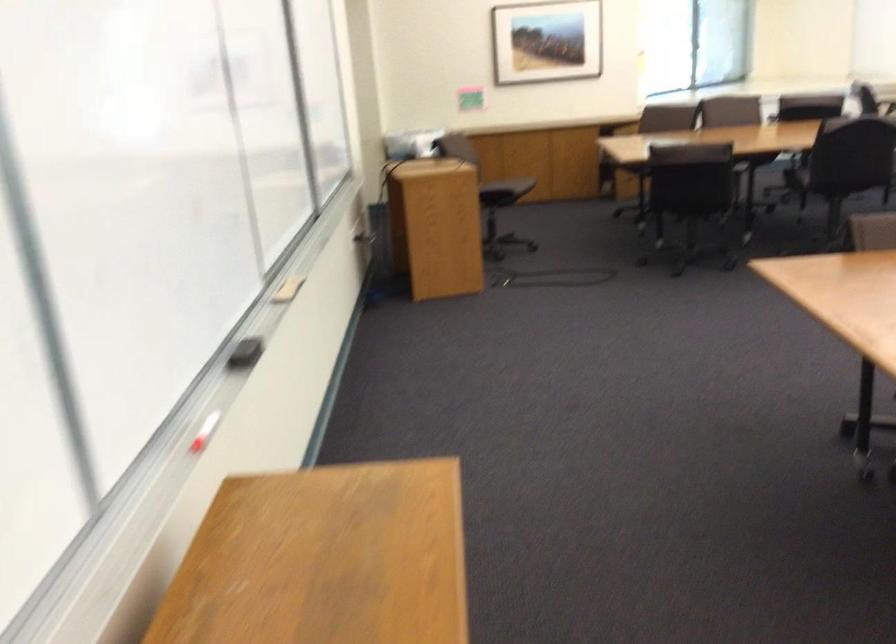
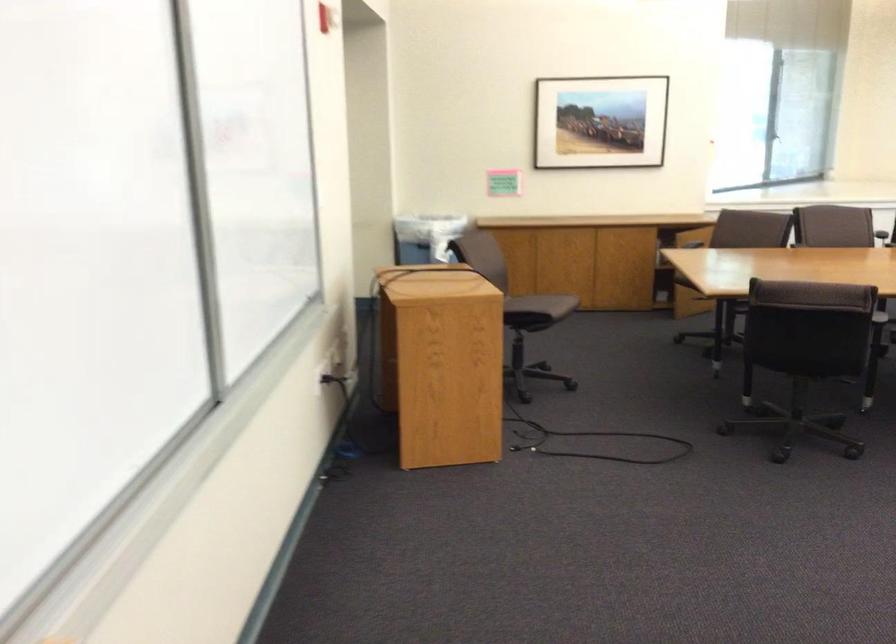
Question: In a continuous first-person perspective shot, in which direction is the camera moving?

Choices:
 (A) Left
 (B) Right
 (C) Forward
 (D) Backward

Answer: (C)